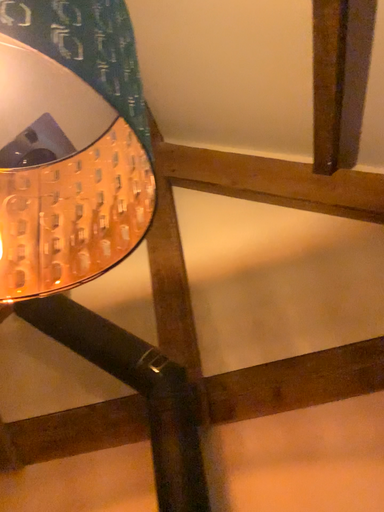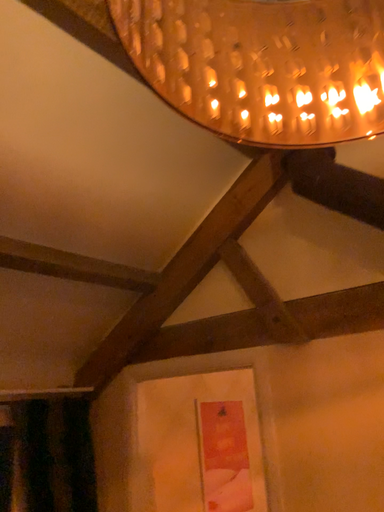
Question: How did the camera likely rotate when shooting the video?

Choices:
 (A) rotated left
 (B) rotated right

Answer: (A)